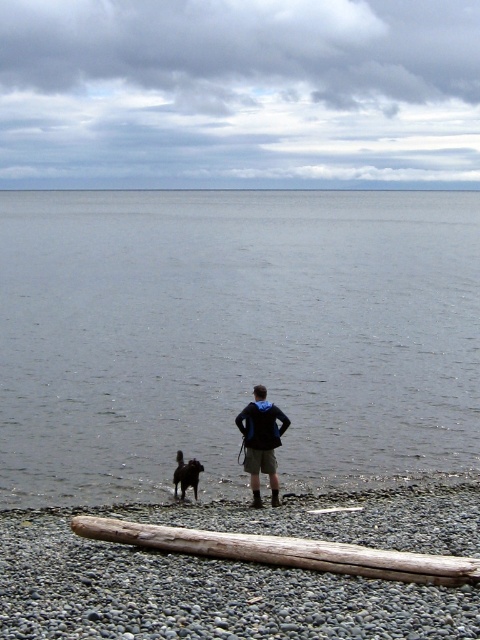
Can you confirm if smooth pebbles at lower center is taller than shiny black fur at lower left?

Incorrect, smooth pebbles at lower center's height is not larger of shiny black fur at lower left's.

Consider the image. Is smooth pebbles at lower center to the right of shiny black fur at lower left from the viewer's perspective?

Indeed, smooth pebbles at lower center is positioned on the right side of shiny black fur at lower left.

Which is in front, point (15, 545) or point (175, 474)?

Point (15, 545)

At what (x,y) coordinates should I click in order to perform the action: click on smooth pebbles at lower center. Please return your answer as a coordinate pair (x, y). Looking at the image, I should click on (199, 593).

Between smooth pebbles at lower center and black matte jacket at center, which one is positioned lower?

smooth pebbles at lower center

Is smooth pebbles at lower center shorter than black matte jacket at center?

Correct, smooth pebbles at lower center is not as tall as black matte jacket at center.

The width and height of the screenshot is (480, 640). Identify the location of smooth pebbles at lower center. (199, 593).

The height and width of the screenshot is (640, 480). In order to click on smooth pebbles at lower center in this screenshot , I will do `click(199, 593)`.

Which is above, black matte jacket at center or shiny black fur at lower left?

black matte jacket at center is above.

Does point (259, 464) come closer to viewer compared to point (183, 481)?

Yes.

Does point (257, 440) come behind point (196, 483)?

No, it is not.

Image resolution: width=480 pixels, height=640 pixels. I want to click on black matte jacket at center, so click(x=262, y=442).